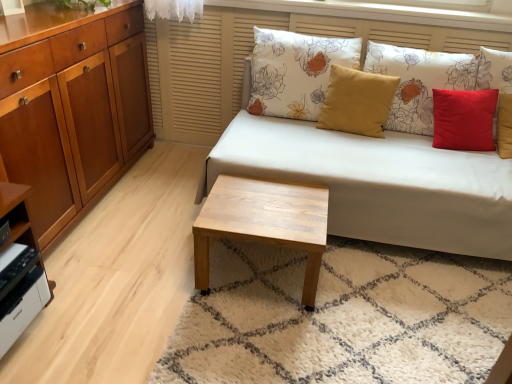
Question: From a real-world perspective, is matte yellow pillow at center, the second pillow when ordered from left to right, above or below light wood/texture coffee table at center?

Choices:
 (A) above
 (B) below

Answer: (A)

Question: Considering the positions of matte yellow pillow at center, which is counted as the 2th pillow, starting from the right, and light wood/texture coffee table at center in the image, is matte yellow pillow at center, which is counted as the 2th pillow, starting from the right, taller or shorter than light wood/texture coffee table at center?

Choices:
 (A) short
 (B) tall

Answer: (B)

Question: Based on their relative distances, which object is farther from the white matte printer at lower left?

Choices:
 (A) white fabric couch at center
 (B) matte wood cabinet at left
 (C) floral fabric pillow at upper center, placed as the 3th pillow when sorted from right to left
 (D) red matte pillow at upper right, marked as the first pillow in a right-to-left arrangement
 (E) light wood/texture coffee table at center

Answer: (D)

Question: Estimate the real-world distances between objects in this image. Which object is closer to the matte yellow pillow at center, the second pillow when ordered from left to right?

Choices:
 (A) white matte printer at lower left
 (B) floral fabric pillow at upper center, marked as the 1th pillow in a left-to-right arrangement
 (C) light wood/texture coffee table at center
 (D) white fabric couch at center
 (E) red matte pillow at upper right, marked as the first pillow in a right-to-left arrangement

Answer: (E)